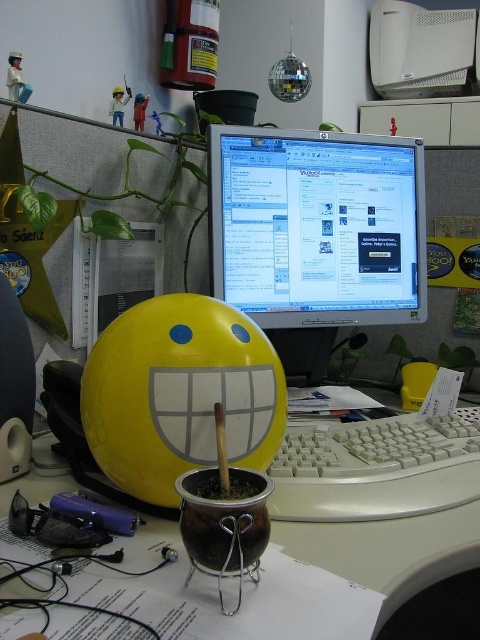
Question: Among these points, which one is farthest from the camera?

Choices:
 (A) (451, 449)
 (B) (298, 550)

Answer: (A)

Question: Observing the image, what is the correct spatial positioning of matte silver monitor at center in reference to white plastic keyboard at center?

Choices:
 (A) right
 (B) left

Answer: (B)

Question: Which object is closer to the camera taking this photo?

Choices:
 (A) white plastic keyboard at center
 (B) white plastic desktop computer at upper center

Answer: (A)

Question: Observing the image, what is the correct spatial positioning of matte silver monitor at center in reference to white plastic keyboard at center?

Choices:
 (A) below
 (B) above

Answer: (B)

Question: Which object is the farthest from the matte silver monitor at center?

Choices:
 (A) white plastic desktop computer at upper center
 (B) brown ceramic pot at center

Answer: (A)

Question: Can you confirm if brown ceramic pot at center is wider than white plastic keyboard at center?

Choices:
 (A) no
 (B) yes

Answer: (B)